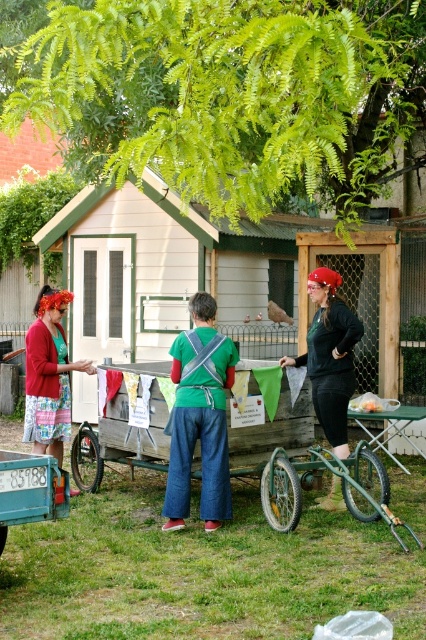
You are standing in the outdoor scene and want to take a photo of the two points mentioned. Which point, point (316, 340) or point (25, 364), will appear larger in your camera view?

Point (316, 340) will appear larger in the camera view because it is closer to the camera than point (25, 364).